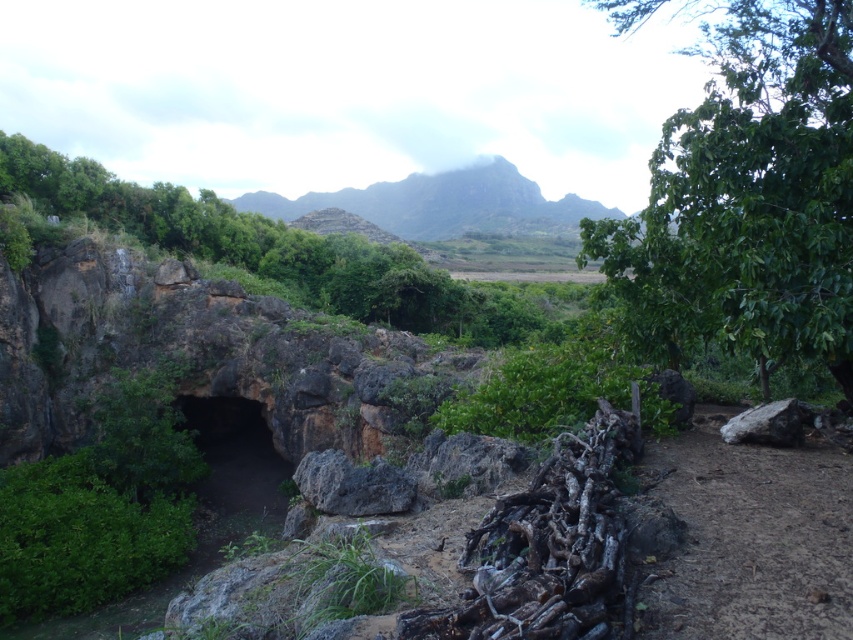
Does rugged stone mountain at upper center appear on the left side of green mossy cave at center?

No, rugged stone mountain at upper center is not to the left of green mossy cave at center.

Describe the element at coordinates (445, 204) in the screenshot. This screenshot has width=853, height=640. I see `rugged stone mountain at upper center` at that location.

Locate an element on the screen. This screenshot has width=853, height=640. rugged stone mountain at upper center is located at coordinates (445, 204).

Which of these two, green mossy cave at center or rough textured rock at center, stands shorter?

With less height is rough textured rock at center.

Does point (201, 433) come in front of point (387, 465)?

No, (201, 433) is behind (387, 465).

Consider the image. Who is more distant from viewer, (206, 538) or (399, 484)?

The point (206, 538) is behind.

This screenshot has height=640, width=853. What are the coordinates of `green mossy cave at center` in the screenshot? It's located at (235, 472).

Is green leafy tree at upper right further to the viewer compared to gray rough rock at right?

No, green leafy tree at upper right is closer to the viewer.

Looking at this image, who is taller, green leafy tree at upper right or gray rough rock at right?

Standing taller between the two is green leafy tree at upper right.

Is point (679, 177) more distant than point (776, 433)?

Yes, it is.

Locate an element on the screen. The width and height of the screenshot is (853, 640). green leafy tree at upper right is located at coordinates (751, 195).